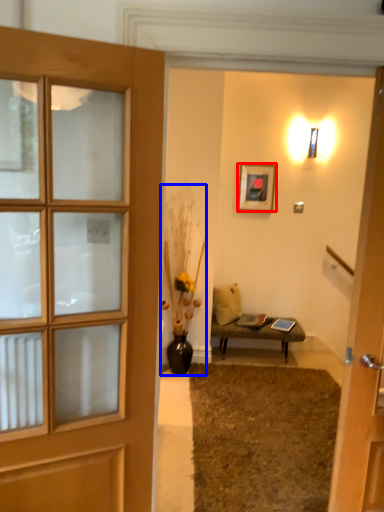
Question: Which object is closer to the camera taking this photo, picture frame (highlighted by a red box) or houseplant (highlighted by a blue box)?

Choices:
 (A) picture frame
 (B) houseplant

Answer: (B)